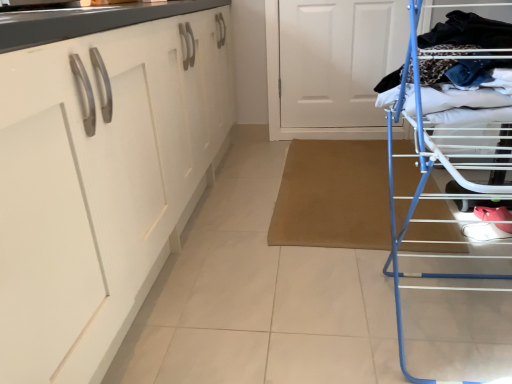
Where is `vacant area to the left of blue metal drying rack at right`? This screenshot has width=512, height=384. vacant area to the left of blue metal drying rack at right is located at coordinates (285, 302).